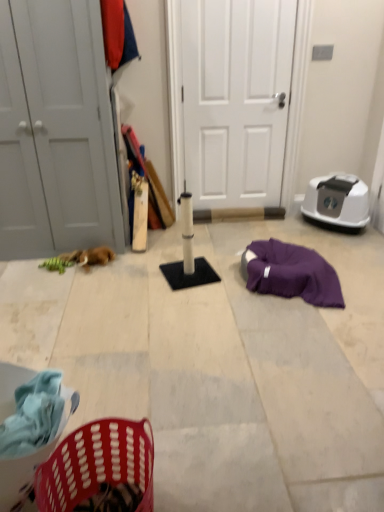
I want to click on white matte door at left, the 1th door positioned from the left, so click(x=55, y=131).

Locate an element on the screen. Image resolution: width=384 pixels, height=512 pixels. plastic laundry basket at lower left is located at coordinates (30, 463).

Measure the distance between brown plush toy at left and camera.

brown plush toy at left and camera are 9.80 feet apart.

Identify the location of white matte scratching post at center. (221, 367).

You are a GUI agent. You are given a task and a screenshot of the screen. Output one action in this format:
    pyautogui.click(x=<x>, y=<y>)
    Task: Click on the white matte door at left, which appears as the 2th door when viewed from the right
    
    Given the screenshot: What is the action you would take?
    pyautogui.click(x=55, y=131)

How different are the orientations of white matte door at left, the 1th door positioned from the left, and white matte scratching post at center in degrees?

white matte door at left, the 1th door positioned from the left, and white matte scratching post at center are facing 179 degrees away from each other.

Does white matte door at left, the 1th door positioned from the left, lie in front of white matte scratching post at center?

No, white matte door at left, the 1th door positioned from the left, is further to the viewer.

Could you tell me if white matte door at left, the 1th door positioned from the left, is facing white matte scratching post at center?

No, white matte door at left, the 1th door positioned from the left, is not aimed at white matte scratching post at center.

From the picture: Is white matte door at left, the 1th door positioned from the left, not near white matte scratching post at center?

Yes, white matte door at left, the 1th door positioned from the left, and white matte scratching post at center are located far from each other.

In the scene shown: From the image's perspective, relative to white matte door at left, which appears as the 2th door when viewed from the right, is plastic laundry basket at lower left above or below?

plastic laundry basket at lower left is below white matte door at left, which appears as the 2th door when viewed from the right.

In terms of width, does plastic laundry basket at lower left look wider or thinner when compared to white matte door at left, the 1th door positioned from the left?

Clearly, plastic laundry basket at lower left has less width compared to white matte door at left, the 1th door positioned from the left.

How many degrees apart are the facing directions of plastic laundry basket at lower left and white matte door at left, the 1th door positioned from the left?

There is a 93.9-degree angle between the facing directions of plastic laundry basket at lower left and white matte door at left, the 1th door positioned from the left.

Considering the positions of objects plastic laundry basket at lower left and white matte door at left, the 1th door positioned from the left, in the image provided, who is more to the left, plastic laundry basket at lower left or white matte door at left, the 1th door positioned from the left,?

From the viewer's perspective, white matte door at left, the 1th door positioned from the left, appears more on the left side.

Considering the relative sizes of white matte scratching post at center and brown plush toy at left in the image provided, is white matte scratching post at center bigger than brown plush toy at left?

Indeed, white matte scratching post at center has a larger size compared to brown plush toy at left.

From their relative heights in the image, would you say white matte scratching post at center is taller or shorter than brown plush toy at left?

In the image, white matte scratching post at center appears to be shorter than brown plush toy at left.

Are white matte scratching post at center and brown plush toy at left beside each other?

white matte scratching post at center and brown plush toy at left are not in contact.

From the image's perspective, is white matte scratching post at center located above or below brown plush toy at left?

From the image's perspective, white matte scratching post at center appears below brown plush toy at left.

Consider the image. From a real-world perspective, who is located lower, brown plush toy at left or plastic laundry basket at lower left?

brown plush toy at left is physically lower.

The image size is (384, 512). What are the coordinates of `animal below the plastic laundry basket at lower left (from a real-world perspective)` in the screenshot? It's located at (89, 256).

Is brown plush toy at left beside plastic laundry basket at lower left?

No, brown plush toy at left is not with plastic laundry basket at lower left.

Can you confirm if brown plush toy at left is shorter than plastic laundry basket at lower left?

Correct, brown plush toy at left is not as tall as plastic laundry basket at lower left.

What's the angular difference between brown plush toy at left and white matte door at center, the 1th door in the right-to-left sequence,'s facing directions?

0.694 degrees separate the facing orientations of brown plush toy at left and white matte door at center, the 1th door in the right-to-left sequence.

Considering the sizes of objects brown plush toy at left and white matte door at center, the 1th door in the right-to-left sequence, in the image provided, who is bigger, brown plush toy at left or white matte door at center, the 1th door in the right-to-left sequence,?

white matte door at center, the 1th door in the right-to-left sequence.

Is brown plush toy at left to the left of white matte door at center, the 1th door in the right-to-left sequence, from the viewer's perspective?

Indeed, brown plush toy at left is positioned on the left side of white matte door at center, the 1th door in the right-to-left sequence.

From a real-world perspective, is brown plush toy at left located higher than white matte door at center, the 1th door in the right-to-left sequence?

No, from a real-world perspective, brown plush toy at left is not over white matte door at center, the 1th door in the right-to-left sequence

Is white matte door at left, the 1th door positioned from the left, bigger or smaller than plastic laundry basket at lower left?

Clearly, white matte door at left, the 1th door positioned from the left, is larger in size than plastic laundry basket at lower left.

Which is further, (11, 195) or (52, 445)?

Point (11, 195)

Is white matte door at left, the 1th door positioned from the left, at the right side of plastic laundry basket at lower left?

No.

In terms of width, does white matte door at left, which appears as the 2th door when viewed from the right, look wider or thinner when compared to plastic laundry basket at lower left?

In the image, white matte door at left, which appears as the 2th door when viewed from the right, appears to be wider than plastic laundry basket at lower left.

From a real-world perspective, is plastic laundry basket at lower left located higher than white matte door at center, the second door when ordered from left to right?

No, from a real-world perspective, plastic laundry basket at lower left is not above white matte door at center, the second door when ordered from left to right.

What's the angular difference between plastic laundry basket at lower left and white matte door at center, the second door when ordered from left to right,'s facing directions?

plastic laundry basket at lower left and white matte door at center, the second door when ordered from left to right, are facing 92.9 degrees away from each other.

From the image's perspective, would you say plastic laundry basket at lower left is shown under white matte door at center, the second door when ordered from left to right?

Indeed, from the image's perspective, plastic laundry basket at lower left is shown beneath white matte door at center, the second door when ordered from left to right.

At what (x,y) coordinates should I click in order to perform the action: click on door on the left of the white matte scratching post at center. Please return your answer as a coordinate pair (x, y). Image resolution: width=384 pixels, height=512 pixels. Looking at the image, I should click on (55, 131).

Locate an element on the screen. The height and width of the screenshot is (512, 384). basket in front of the white matte door at left, the 1th door positioned from the left is located at coordinates (30, 463).

From the picture: From the image, which object appears to be nearer to white matte door at left, the 1th door positioned from the left, white matte door at center, the second door when ordered from left to right, or plastic laundry basket at lower left?

white matte door at center, the second door when ordered from left to right.

Estimate the real-world distances between objects in this image. Which object is further from brown plush toy at left, white matte scratching post at center or white matte door at center, the 1th door in the right-to-left sequence?

white matte door at center, the 1th door in the right-to-left sequence, lies further to brown plush toy at left than the other object.

From the picture: Which object lies further to the anchor point white matte scratching post at center, plastic laundry basket at lower left or white matte door at center, the second door when ordered from left to right?

white matte door at center, the second door when ordered from left to right.

Estimate the real-world distances between objects in this image. Which object is closer to brown plush toy at left, white matte door at center, the 1th door in the right-to-left sequence, or white matte door at left, which appears as the 2th door when viewed from the right?

white matte door at left, which appears as the 2th door when viewed from the right, is positioned closer to the anchor brown plush toy at left.

Consider the image. Based on their spatial positions, is white matte door at left, the 1th door positioned from the left, or plastic laundry basket at lower left further from brown plush toy at left?

plastic laundry basket at lower left is positioned further to the anchor brown plush toy at left.

Based on their spatial positions, is white matte door at center, the 1th door in the right-to-left sequence, or brown plush toy at left closer to white matte scratching post at center?

Based on the image, brown plush toy at left appears to be nearer to white matte scratching post at center.

Based on their spatial positions, is white matte door at center, the second door when ordered from left to right, or white matte door at left, the 1th door positioned from the left, closer to plastic laundry basket at lower left?

Among the two, white matte door at left, the 1th door positioned from the left, is located nearer to plastic laundry basket at lower left.

Considering their positions, is brown plush toy at left positioned further to white matte scratching post at center than plastic laundry basket at lower left?

Based on the image, plastic laundry basket at lower left appears to be further to white matte scratching post at center.

Find the location of a particular element. The image size is (384, 512). door positioned between white matte scratching post at center and white matte door at center, the 1th door in the right-to-left sequence, from near to far is located at coordinates (55, 131).

Find the location of `animal between white matte door at left, the 1th door positioned from the left, and white matte door at center, the second door when ordered from left to right, in the horizontal direction`. animal between white matte door at left, the 1th door positioned from the left, and white matte door at center, the second door when ordered from left to right, in the horizontal direction is located at coordinates (89, 256).

The width and height of the screenshot is (384, 512). In order to click on concrete between white matte door at left, the 1th door positioned from the left, and plastic laundry basket at lower left, in the vertical direction in this screenshot , I will do `click(221, 367)`.

Find the location of a particular element. door between white matte scratching post at center and brown plush toy at left along the z-axis is located at coordinates (55, 131).